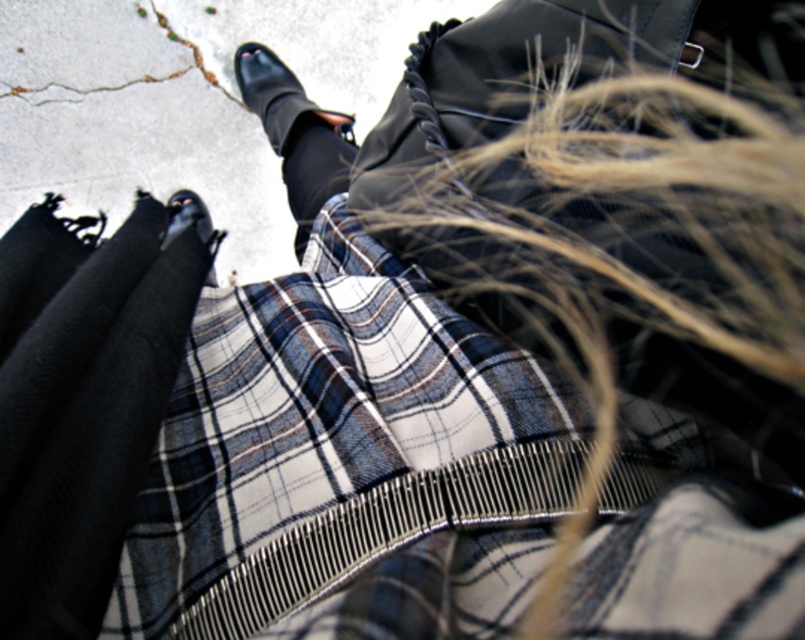
Which is more to the left, black woolen tights at lower left or black smooth sock at center?

Positioned to the left is black woolen tights at lower left.

The image size is (805, 640). In order to click on black woolen tights at lower left in this screenshot , I will do `click(81, 403)`.

I want to click on black woolen tights at lower left, so click(x=81, y=403).

Between point (541, 545) and point (180, 228), which one is positioned in front?

Point (541, 545)

Which is behind, point (675, 444) or point (201, 208)?

The point (201, 208) is behind.

I want to click on plaid fabric at center, so click(312, 412).

Does plaid fabric at center have a larger size compared to black leather shoe at center?

Yes, plaid fabric at center is bigger than black leather shoe at center.

Between point (372, 273) and point (254, 45), which one is positioned behind?

Positioned behind is point (254, 45).

The width and height of the screenshot is (805, 640). In order to click on plaid fabric at center in this screenshot , I will do `click(312, 412)`.